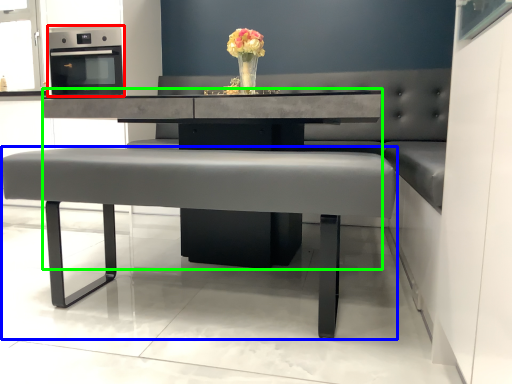
Question: Estimate the real-world distances between objects in this image. Which object is farther from appliance (highlighted by a red box), table (highlighted by a blue box) or round table (highlighted by a green box)?

Choices:
 (A) table
 (B) round table

Answer: (A)